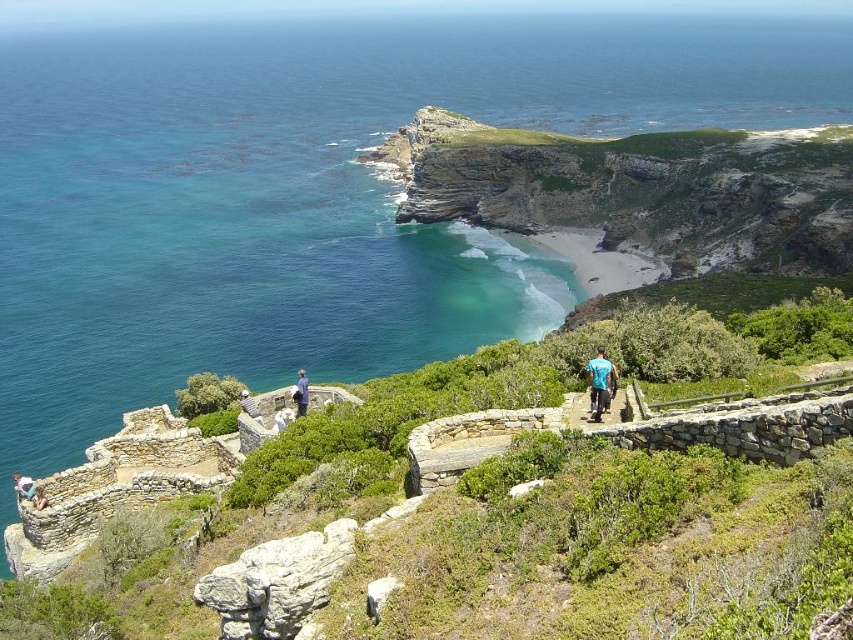
Who is positioned more to the right, blue fabric shirt at center or blue denim jeans at lower left?

From the viewer's perspective, blue fabric shirt at center appears more on the right side.

Does blue fabric shirt at center have a greater height compared to blue denim jeans at lower left?

In fact, blue fabric shirt at center may be shorter than blue denim jeans at lower left.

The height and width of the screenshot is (640, 853). What do you see at coordinates (300, 392) in the screenshot?
I see `blue fabric shirt at center` at bounding box center [300, 392].

Where is `blue fabric shirt at center`? This screenshot has width=853, height=640. blue fabric shirt at center is located at coordinates (300, 392).

Can you confirm if blue fabric shirt at center-right is bigger than blue fabric shirt at center?

No, blue fabric shirt at center-right is not bigger than blue fabric shirt at center.

Which is more to the left, blue fabric shirt at center-right or blue fabric shirt at center?

From the viewer's perspective, blue fabric shirt at center appears more on the left side.

Who is more distant from viewer, (593, 408) or (302, 381)?

The point (302, 381) is behind.

Where is `blue fabric shirt at center-right`? The width and height of the screenshot is (853, 640). blue fabric shirt at center-right is located at coordinates (599, 381).

Can you confirm if blue denim jeans at lower left is shorter than light blue fabric at center?

In fact, blue denim jeans at lower left may be taller than light blue fabric at center.

Between blue denim jeans at lower left and light blue fabric at center, which one is positioned higher?

light blue fabric at center is higher up.

Does point (25, 484) lie in front of point (247, 400)?

Yes, it is in front of point (247, 400).

The width and height of the screenshot is (853, 640). What are the coordinates of `blue denim jeans at lower left` in the screenshot? It's located at (22, 486).